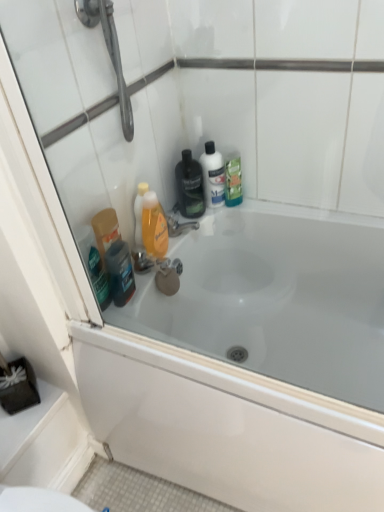
Find the location of a particular element. This screenshot has width=384, height=512. free space to the right of translucent plastic mouthwash at upper right, which is counted as the 4th mouthwash, starting from the left is located at coordinates (275, 209).